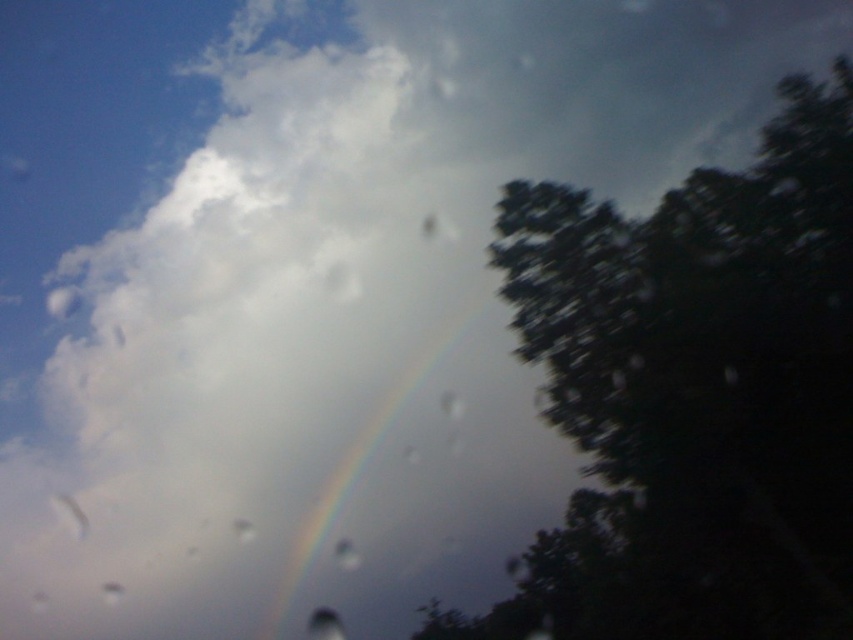
You are driving through a storm and see the dark green leafy tree at right and the rainbow at center outside your window. Which object is closer to your car?

The dark green leafy tree at right is closer to the viewer than the rainbow at center, so the tree is closer to your car.

You are driving a car and see the dark green leafy tree at right and the rainbow at center through the windshield. If your car has a 10 feet long ladder in the trunk, can you place the ladder between them?

The distance between the dark green leafy tree at right and the rainbow at center is 35.28 feet, so the 10 feet long ladder would be too short to bridge the gap between them.

You are inside a car looking at the sky through the windshield. You notice two points in the scene. The first point is at coordinate point [815,120] and the second is at point [422,368]. Which point is closer to you?

Point [815,120] is closer to the camera than point [422,368], so the first point is closer to you.